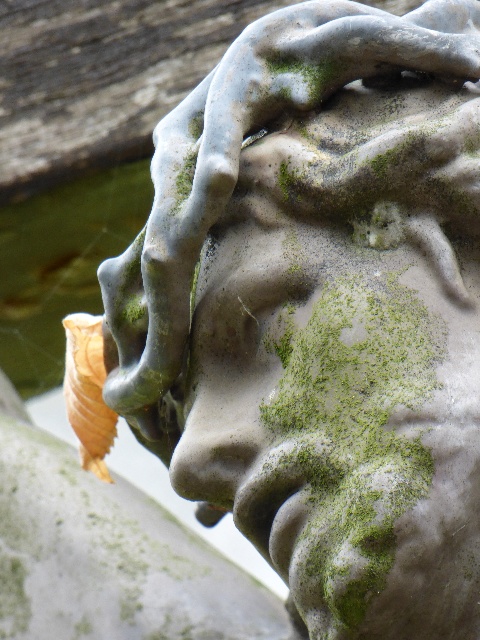
Question: Where is green mossy stone face at center located in relation to orange papery leaf at lower left in the image?

Choices:
 (A) right
 (B) left

Answer: (A)

Question: Observing the image, what is the correct spatial positioning of green mossy stone face at center in reference to orange papery leaf at lower left?

Choices:
 (A) left
 (B) right

Answer: (B)

Question: Which point is closer to the camera taking this photo?

Choices:
 (A) (82, 426)
 (B) (284, 522)

Answer: (B)

Question: Which of the following is the farthest from the observer?

Choices:
 (A) (200, 336)
 (B) (86, 372)

Answer: (B)

Question: Considering the relative positions of green mossy stone face at center and orange papery leaf at lower left in the image provided, where is green mossy stone face at center located with respect to orange papery leaf at lower left?

Choices:
 (A) right
 (B) left

Answer: (A)